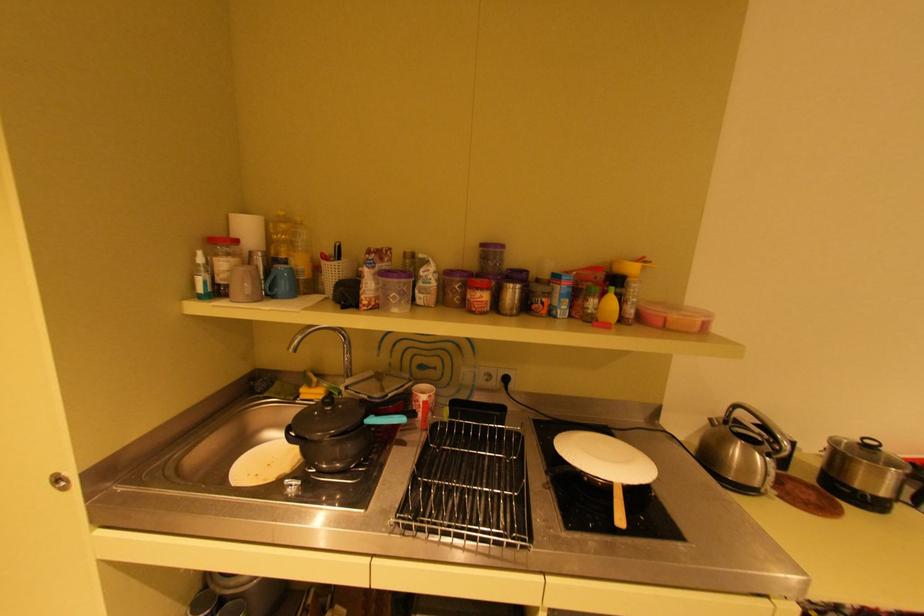
What do you see at coordinates (59, 482) in the screenshot? I see `the silver cabinet knob` at bounding box center [59, 482].